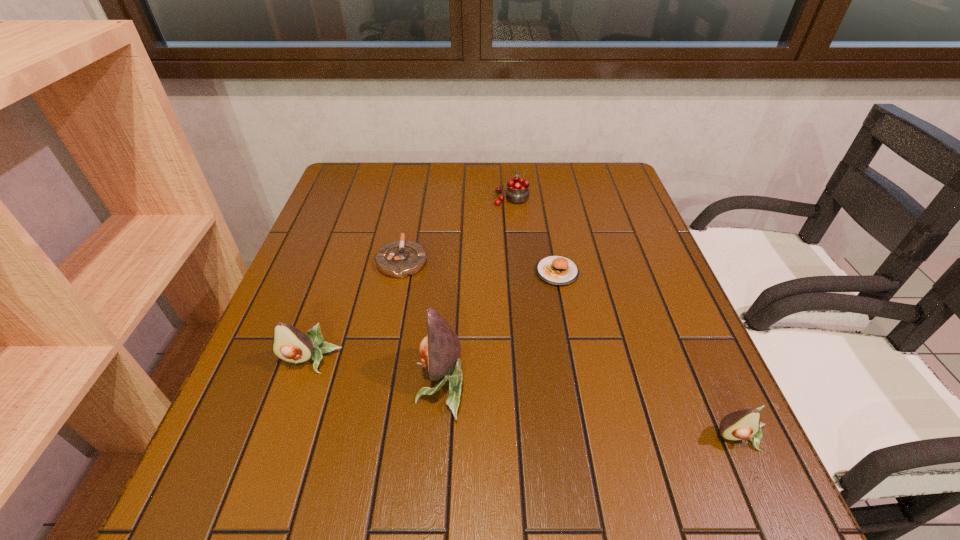
Image resolution: width=960 pixels, height=540 pixels. Find the location of `object that is positioned at the right edge`. object that is positioned at the right edge is located at coordinates (745, 424).

At what (x,y) coordinates should I click in order to perform the action: click on object positioned at the near right corner. Please return your answer as a coordinate pair (x, y). The height and width of the screenshot is (540, 960). Looking at the image, I should click on (745, 424).

At what (x,y) coordinates should I click in order to perform the action: click on vacant space at the far edge of the desktop. Please return your answer as a coordinate pair (x, y). Looking at the image, I should click on (421, 167).

Find the location of a particular element. Image resolution: width=960 pixels, height=540 pixels. blank space at the left edge of the desktop is located at coordinates pos(351,214).

Where is `vacant region at the right edge of the desktop`? vacant region at the right edge of the desktop is located at coordinates click(x=690, y=332).

Where is `free region at the far left corner of the desktop`? free region at the far left corner of the desktop is located at coordinates (343, 196).

In the image, there is a desktop. Find the location of `vacant space at the near left corner`. vacant space at the near left corner is located at coordinates (248, 431).

The image size is (960, 540). I want to click on vacant area at the far right corner, so click(615, 176).

The height and width of the screenshot is (540, 960). Find the location of `free point at the near right corner`. free point at the near right corner is located at coordinates (706, 443).

The height and width of the screenshot is (540, 960). Find the location of `empty location between the rightmost avocado and the second object from left to right`. empty location between the rightmost avocado and the second object from left to right is located at coordinates (571, 349).